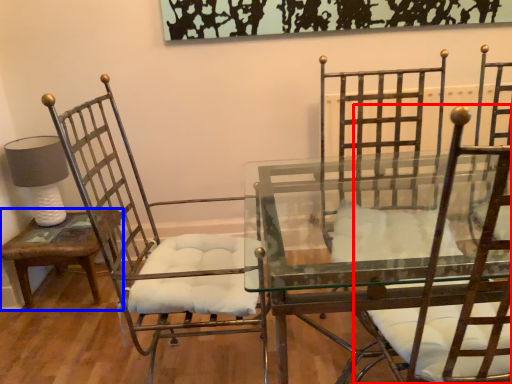
Question: Which object is closer to the camera taking this photo, chair (highlighted by a red box) or table (highlighted by a blue box)?

Choices:
 (A) chair
 (B) table

Answer: (A)